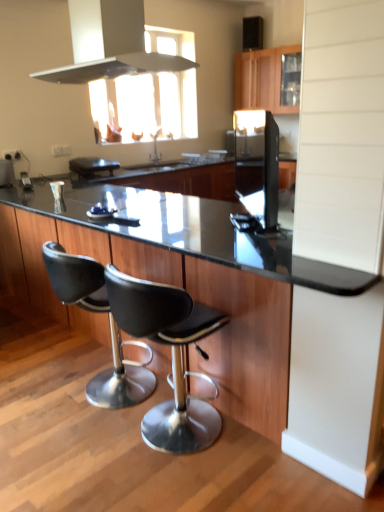
Where is `metallic silver exhaust hood at upper center`? The image size is (384, 512). metallic silver exhaust hood at upper center is located at coordinates (116, 67).

From the picture: In order to face metallic silver exhaust hood at upper center, should I rotate leftwards or rightwards?

To align with it, rotate left about 11.166°.

You are a GUI agent. You are given a task and a screenshot of the screen. Output one action in this format:
    pyautogui.click(x=<x>, y=<y>)
    Task: Click on the black glossy refrigerator at center, which ranks as the 1th appliance in bottom-to-top order
    
    Given the screenshot: What is the action you would take?
    pyautogui.click(x=257, y=164)

Identify the location of black glass countertop at center, placed as the 1th countertop when sorted from right to left. The image size is (384, 512). (204, 292).

Measure the distance between black leather stool at center, positioned as the second chair in right-to-left order, and camera.

black leather stool at center, positioned as the second chair in right-to-left order, is 7.20 feet from camera.

How much space does black leather stool at center, positioned as the second chair in right-to-left order, occupy horizontally?

black leather stool at center, positioned as the second chair in right-to-left order, is 21.34 inches in width.

Describe the element at coordinates (262, 79) in the screenshot. The height and width of the screenshot is (512, 384). I see `wooden cabinet at upper center` at that location.

In order to face black leather stool at center, which appears as the second chair when viewed from the left, should I rotate leftwards or rightwards?

It's best to rotate left around 3.618 degrees.

Find the location of a particular element. metallic silver exhaust hood at upper center is located at coordinates (116, 67).

From the image's perspective, is black leather stool at center, which is counted as the first chair, starting from the right, above or below black matte toaster at center, which appears as the 2th appliance when viewed from the front?

Based on their image positions, black leather stool at center, which is counted as the first chair, starting from the right, is located beneath black matte toaster at center, which appears as the 2th appliance when viewed from the front.

From a real-world perspective, starting from the black matte toaster at center, placed as the first appliance when sorted from top to bottom, which chair is the 2nd one below it? Please provide its 2D coordinates.

[(172, 356)]

Based on the photo, is black leather stool at center, which is counted as the first chair, starting from the right, beside black matte toaster at center, placed as the first appliance when sorted from top to bottom?

No, black leather stool at center, which is counted as the first chair, starting from the right, is not in contact with black matte toaster at center, placed as the first appliance when sorted from top to bottom.

Is metallic silver exhaust hood at upper center next to black leather stool at center, which is counted as the first chair, starting from the right?

No.

Is point (88, 65) less distant than point (164, 418)?

No, (88, 65) is behind (164, 418).

Which of these two, metallic silver exhaust hood at upper center or black leather stool at center, which appears as the second chair when viewed from the left, stands taller?

black leather stool at center, which appears as the second chair when viewed from the left, is taller.

From the image's perspective, would you say metallic silver exhaust hood at upper center is positioned over black leather stool at center, which is counted as the first chair, starting from the right?

Yes, from the image's perspective, metallic silver exhaust hood at upper center is over black leather stool at center, which is counted as the first chair, starting from the right.

In the image, is wooden cabinet at upper center on the left side or the right side of black leather stool at center, which appears as the second chair when viewed from the left?

From the image, it's evident that wooden cabinet at upper center is to the right of black leather stool at center, which appears as the second chair when viewed from the left.

Does wooden cabinet at upper center have a smaller size compared to black leather stool at center, which appears as the second chair when viewed from the left?

No.

From a real-world perspective, is wooden cabinet at upper center above or below black leather stool at center, which is counted as the first chair, starting from the right?

In terms of real-world spatial position, wooden cabinet at upper center is above black leather stool at center, which is counted as the first chair, starting from the right.

Which of these two, wooden cabinet at upper center or black leather stool at center, which is counted as the first chair, starting from the right, is wider?

black leather stool at center, which is counted as the first chair, starting from the right.

From the picture: Between wooden cabinet at upper center and black glass countertop at center, which ranks as the second countertop in left-to-right order, which one has more height?

black glass countertop at center, which ranks as the second countertop in left-to-right order, is taller.

From a real-world perspective, is wooden cabinet at upper center located beneath black glass countertop at center, which ranks as the second countertop in left-to-right order?

No, from a real-world perspective, wooden cabinet at upper center is not below black glass countertop at center, which ranks as the second countertop in left-to-right order.

Is wooden cabinet at upper center beside black glass countertop at center, which ranks as the second countertop in left-to-right order?

No, wooden cabinet at upper center is not next to black glass countertop at center, which ranks as the second countertop in left-to-right order.

Is wooden cabinet at upper center oriented towards black glass countertop at center, which ranks as the second countertop in left-to-right order?

No, wooden cabinet at upper center is not turned towards black glass countertop at center, which ranks as the second countertop in left-to-right order.

Considering the relative positions of black matte toaster at center, placed as the first appliance when sorted from top to bottom, and black leather stool at center, placed as the first chair when sorted from left to right, in the image provided, is black matte toaster at center, placed as the first appliance when sorted from top to bottom, to the right of black leather stool at center, placed as the first chair when sorted from left to right, from the viewer's perspective?

In fact, black matte toaster at center, placed as the first appliance when sorted from top to bottom, is to the left of black leather stool at center, placed as the first chair when sorted from left to right.

Measure the distance between black matte toaster at center, which is counted as the 2th appliance, starting from the right, and black leather stool at center, placed as the first chair when sorted from left to right.

The distance of black matte toaster at center, which is counted as the 2th appliance, starting from the right, from black leather stool at center, placed as the first chair when sorted from left to right, is 2.33 meters.

Where is `appliance to the left of black leather stool at center, placed as the first chair when sorted from left to right`? The width and height of the screenshot is (384, 512). appliance to the left of black leather stool at center, placed as the first chair when sorted from left to right is located at coordinates (92, 167).

Considering their positions, is black matte toaster at center, which appears as the 2th appliance when viewed from the front, located in front of or behind black leather stool at center, positioned as the second chair in right-to-left order?

Clearly, black matte toaster at center, which appears as the 2th appliance when viewed from the front, is behind black leather stool at center, positioned as the second chair in right-to-left order.

Where is `countertop that is in front of the black leather stool at center, placed as the first chair when sorted from left to right`? The height and width of the screenshot is (512, 384). countertop that is in front of the black leather stool at center, placed as the first chair when sorted from left to right is located at coordinates (204, 292).

Is black glass countertop at center, placed as the 1th countertop when sorted from right to left, shorter than black leather stool at center, positioned as the second chair in right-to-left order?

Incorrect, the height of black glass countertop at center, placed as the 1th countertop when sorted from right to left, does not fall short of that of black leather stool at center, positioned as the second chair in right-to-left order.

From the image's perspective, is black glass countertop at center, placed as the 1th countertop when sorted from right to left, located above or below black leather stool at center, positioned as the second chair in right-to-left order?

black glass countertop at center, placed as the 1th countertop when sorted from right to left, is situated higher than black leather stool at center, positioned as the second chair in right-to-left order, in the image.

Find the location of a particular element. exhaust hood above the black leather stool at center, positioned as the second chair in right-to-left order (from the image's perspective) is located at coordinates (116, 67).

Is black leather stool at center, placed as the first chair when sorted from left to right, turned away from metallic silver exhaust hood at upper center?

That's not correct — black leather stool at center, placed as the first chair when sorted from left to right, is not looking away from metallic silver exhaust hood at upper center.

Is metallic silver exhaust hood at upper center completely or partially inside black leather stool at center, positioned as the second chair in right-to-left order?

No, metallic silver exhaust hood at upper center is not inside black leather stool at center, positioned as the second chair in right-to-left order.

Consider the image. In terms of size, does black leather stool at center, placed as the first chair when sorted from left to right, appear bigger or smaller than metallic silver exhaust hood at upper center?

Considering their sizes, black leather stool at center, placed as the first chair when sorted from left to right, takes up less space than metallic silver exhaust hood at upper center.

The height and width of the screenshot is (512, 384). I want to click on chair that is the 2nd one when counting rightward from the black matte toaster at center, placed as the first appliance when sorted from top to bottom, so click(172, 356).

At what (x,y) coordinates should I click in order to perform the action: click on exhaust hood positioned vertically above the black leather stool at center, which appears as the second chair when viewed from the left (from a real-world perspective). Please return your answer as a coordinate pair (x, y). This screenshot has width=384, height=512. Looking at the image, I should click on (116, 67).

Which object lies nearer to the anchor point black leather stool at center, placed as the first chair when sorted from left to right, wooden cabinet at upper center or metallic silver exhaust hood at upper center?

metallic silver exhaust hood at upper center lies closer to black leather stool at center, placed as the first chair when sorted from left to right, than the other object.

From the image, which object appears to be farther from wooden cabinet at upper center, black granite countertop at center, the first countertop viewed from the left, or black matte toaster at center, placed as the first appliance when sorted from top to bottom?

Among the two, black granite countertop at center, the first countertop viewed from the left, is located further to wooden cabinet at upper center.

From the image, which object appears to be farther from black glass countertop at center, which ranks as the second countertop in left-to-right order, wooden cabinet at upper center or black glossy refrigerator at center, which is the first appliance in right-to-left order?

wooden cabinet at upper center lies further to black glass countertop at center, which ranks as the second countertop in left-to-right order, than the other object.

From the image, which object appears to be farther from black glossy refrigerator at center, arranged as the second appliance when viewed from the back, wooden cabinet at upper center or black matte toaster at center, placed as the first appliance when sorted from top to bottom?

black matte toaster at center, placed as the first appliance when sorted from top to bottom.

From the image, which object appears to be farther from black glass countertop at center, placed as the 1th countertop when sorted from right to left, black leather stool at center, positioned as the second chair in right-to-left order, or wooden cabinet at upper center?

wooden cabinet at upper center is further to black glass countertop at center, placed as the 1th countertop when sorted from right to left.

Based on their spatial positions, is wooden cabinet at upper center or black granite countertop at center, the second countertop positioned from the right, closer to black glass countertop at center, which ranks as the second countertop in left-to-right order?

black granite countertop at center, the second countertop positioned from the right.

Which object lies nearer to the anchor point black leather stool at center, which appears as the second chair when viewed from the left, black granite countertop at center, the first countertop viewed from the left, or black matte toaster at center, which appears as the 2th appliance when viewed from the front?

black granite countertop at center, the first countertop viewed from the left, is closer to black leather stool at center, which appears as the second chair when viewed from the left.

From the image, which object appears to be nearer to black glossy refrigerator at center, which is the first appliance in right-to-left order, black matte toaster at center, which appears as the 2th appliance when viewed from the front, or wooden cabinet at upper center?

The object closer to black glossy refrigerator at center, which is the first appliance in right-to-left order, is wooden cabinet at upper center.

You are a GUI agent. You are given a task and a screenshot of the screen. Output one action in this format:
    pyautogui.click(x=<x>, y=<y>)
    Task: Click on the exhaust hood located between black glossy refrigerator at center, arranged as the second appliance when viewed from the back, and wooden cabinet at upper center in the depth direction
    The width and height of the screenshot is (384, 512).
    Given the screenshot: What is the action you would take?
    pyautogui.click(x=116, y=67)

Identify the location of chair between black glass countertop at center, placed as the 1th countertop when sorted from right to left, and black granite countertop at center, the second countertop positioned from the right, in the front-back direction. This screenshot has height=512, width=384. (110, 328).

Find the location of `exhaust hood between black glossy refrigerator at center, which is the first appliance in right-to-left order, and black matte toaster at center, which is counted as the 2th appliance, starting from the right, along the z-axis`. exhaust hood between black glossy refrigerator at center, which is the first appliance in right-to-left order, and black matte toaster at center, which is counted as the 2th appliance, starting from the right, along the z-axis is located at coordinates (116, 67).

The width and height of the screenshot is (384, 512). Identify the location of appliance between black glass countertop at center, placed as the 1th countertop when sorted from right to left, and black granite countertop at center, the second countertop positioned from the right, along the z-axis. (257, 164).